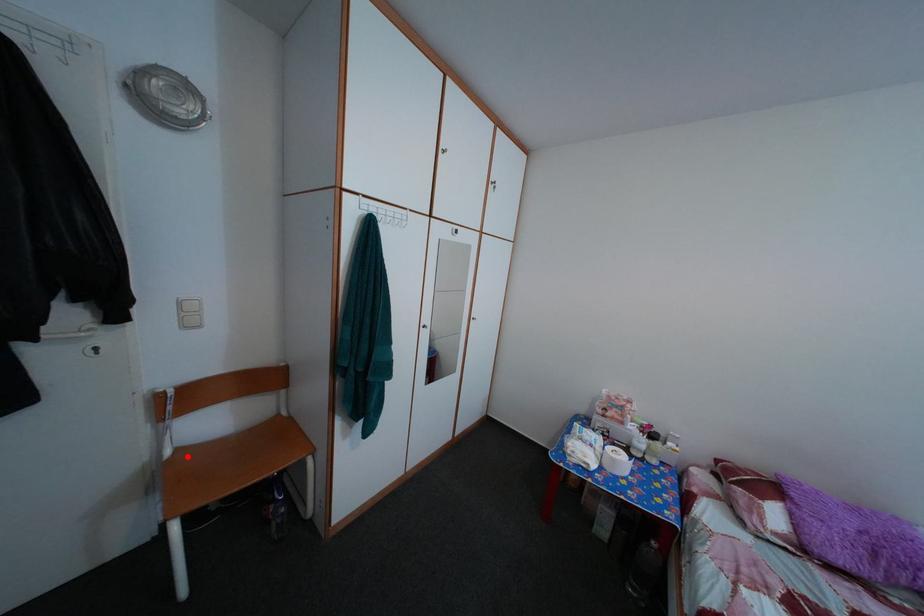
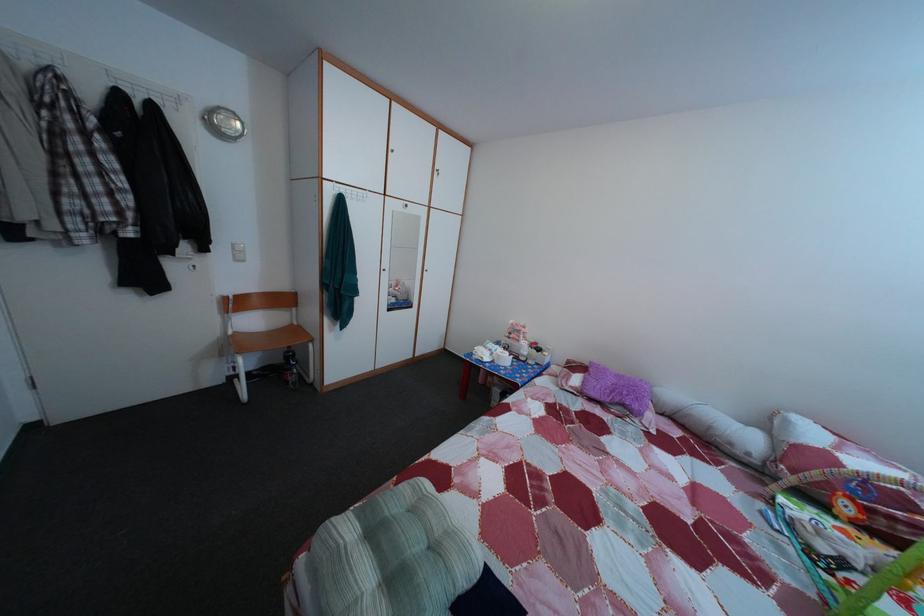
In the second image, find the point that corresponds to the highlighted location in the first image.

(245, 339)